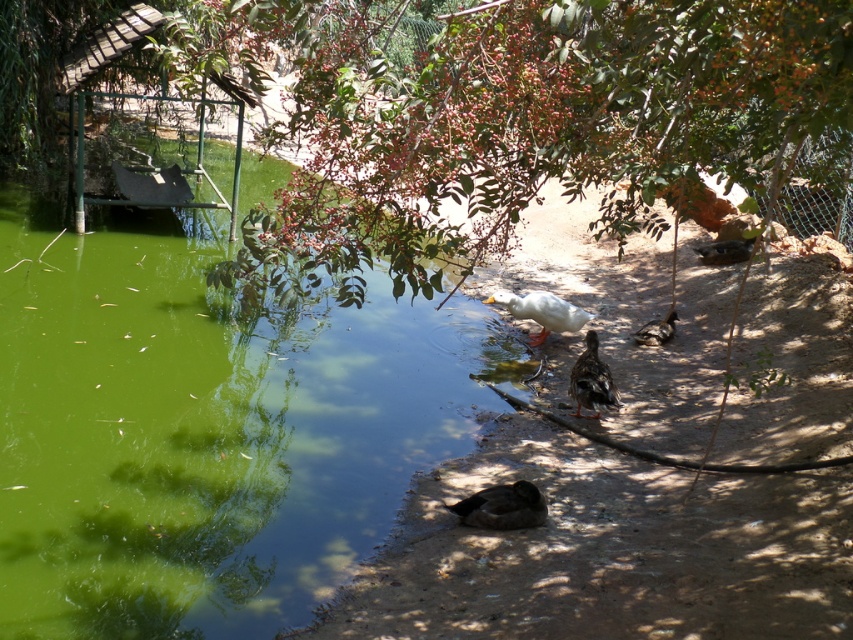
From the picture: You are a birdwatcher standing at the edge of the pond, and you want to observe both the brown fuzzy duck at lower center and the brown speckled duck at center without moving your position. Can you see both ducks clearly from where you are?

The brown fuzzy duck at lower center is 4.50 feet away from the brown speckled duck at center. Since they are positioned at lower center and center respectively, and the distance between them is not too far, you can likely see both ducks clearly from your current position at the edge of the pond.

You are standing at the point with coordinates point [120,298] and want to walk to the point with coordinates point [647,339]. Which direction should you move to get closer to your destination?

You should move backward because point [120,298] is in front of point [647,339], meaning the destination is behind your current position.

You are a birdwatcher observing the ducks at the pond. You notice the white matte duck at center and the brown speckled duck at center. Which duck is shorter in height?

The white matte duck at center is shorter in height compared to the brown speckled duck at center.